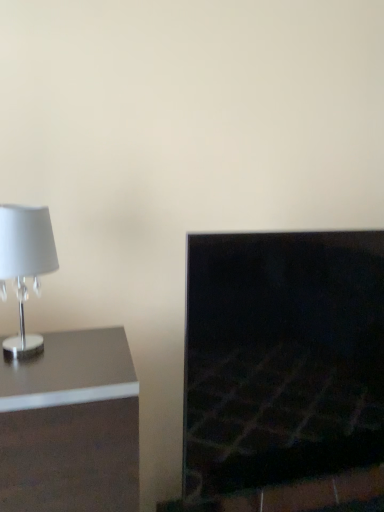
Question: Does satin silver lamp at left have a larger size compared to dark stone fireplace at right?

Choices:
 (A) yes
 (B) no

Answer: (A)

Question: Does satin silver lamp at left have a smaller size compared to dark stone fireplace at right?

Choices:
 (A) no
 (B) yes

Answer: (A)

Question: Does satin silver lamp at left have a lesser height compared to dark stone fireplace at right?

Choices:
 (A) no
 (B) yes

Answer: (B)

Question: Is dark stone fireplace at right a part of satin silver lamp at left?

Choices:
 (A) yes
 (B) no

Answer: (B)

Question: Does satin silver lamp at left have a lesser width compared to dark stone fireplace at right?

Choices:
 (A) yes
 (B) no

Answer: (B)

Question: Is satin silver lamp at left turned away from dark stone fireplace at right?

Choices:
 (A) yes
 (B) no

Answer: (B)

Question: Does white glossy lampshade at left have a greater width compared to dark stone fireplace at right?

Choices:
 (A) yes
 (B) no

Answer: (A)

Question: From the image's perspective, would you say white glossy lampshade at left is positioned over dark stone fireplace at right?

Choices:
 (A) yes
 (B) no

Answer: (A)

Question: Is dark stone fireplace at right surrounded by white glossy lampshade at left?

Choices:
 (A) yes
 (B) no

Answer: (B)

Question: Are white glossy lampshade at left and dark stone fireplace at right beside each other?

Choices:
 (A) no
 (B) yes

Answer: (A)

Question: From a real-world perspective, does white glossy lampshade at left stand above dark stone fireplace at right?

Choices:
 (A) no
 (B) yes

Answer: (B)

Question: Can you confirm if white glossy lampshade at left is taller than dark stone fireplace at right?

Choices:
 (A) yes
 (B) no

Answer: (B)

Question: Considering the relative sizes of dark stone fireplace at right and satin silver lamp at left in the image provided, is dark stone fireplace at right bigger than satin silver lamp at left?

Choices:
 (A) yes
 (B) no

Answer: (B)